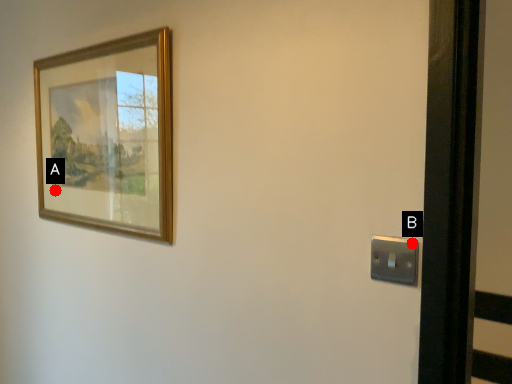
Question: Two points are circled on the image, labeled by A and B beside each circle. Which point is closer to the camera?

Choices:
 (A) A is closer
 (B) B is closer

Answer: (B)